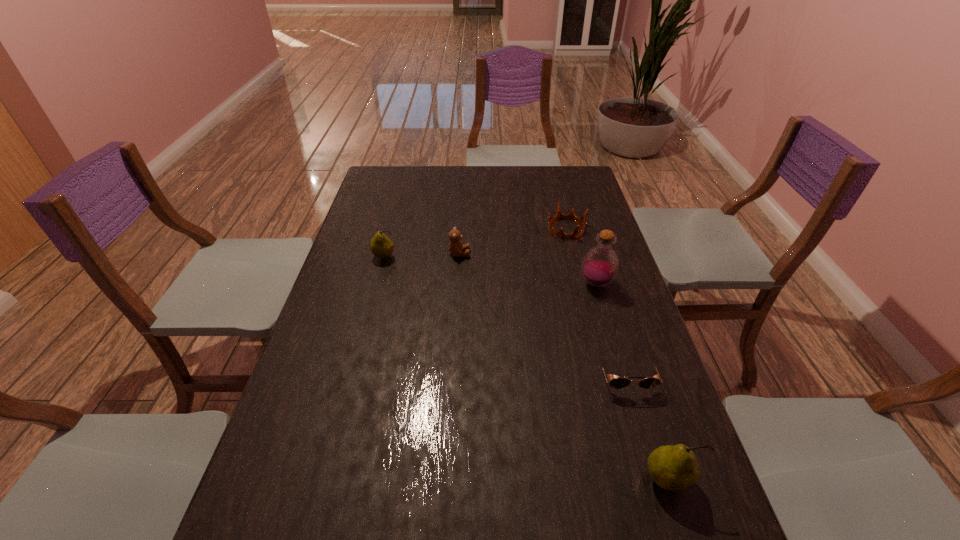
The image size is (960, 540). Identify the location of object that is the fourth closest one to the farther pear. (617, 383).

This screenshot has width=960, height=540. What are the coordinates of `the second closest object to the farthest object` in the screenshot? It's located at (456, 247).

You are a GUI agent. You are given a task and a screenshot of the screen. Output one action in this format:
    pyautogui.click(x=<x>, y=<y>)
    Task: Click on the blank area in the image that satisfies the following two spatial constraints: 1. on the front side of the left pear; 2. on the left side of the tallest object
    Image resolution: width=960 pixels, height=540 pixels.
    Given the screenshot: What is the action you would take?
    [x=377, y=284]

This screenshot has height=540, width=960. I want to click on vacant space that satisfies the following two spatial constraints: 1. on the front side of the bottle; 2. on the right side of the farthest object, so click(x=580, y=284).

This screenshot has width=960, height=540. I want to click on blank area in the image that satisfies the following two spatial constraints: 1. on the back side of the taller pear; 2. on the face of the fourth tallest object, so click(x=595, y=254).

This screenshot has width=960, height=540. In order to click on vacant space that satisfies the following two spatial constraints: 1. on the front lenses of the second nearest object; 2. on the left side of the taller pear in this screenshot , I will do `click(657, 480)`.

This screenshot has height=540, width=960. Find the location of `free location that satisfies the following two spatial constraints: 1. on the front side of the right pear; 2. on the right side of the crown`. free location that satisfies the following two spatial constraints: 1. on the front side of the right pear; 2. on the right side of the crown is located at coordinates (631, 480).